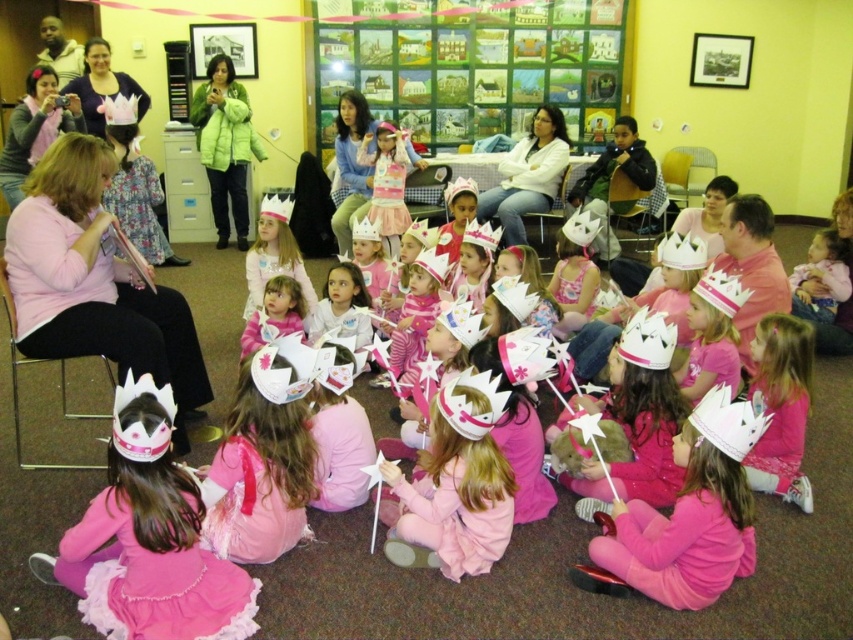
Can you confirm if pink satin dress at center is shorter than matte pink crown at upper left?

No.

Describe the element at coordinates (387, 182) in the screenshot. I see `pink satin dress at center` at that location.

Which is in front, point (393, 152) or point (97, 36)?

Positioned in front is point (393, 152).

Find the location of a particular element. pink satin dress at center is located at coordinates (387, 182).

Does green matte bulletin board at upper center lie in front of pink paper crown at center?

That is False.

This screenshot has height=640, width=853. Describe the element at coordinates (474, 65) in the screenshot. I see `green matte bulletin board at upper center` at that location.

The height and width of the screenshot is (640, 853). Identify the location of green matte bulletin board at upper center. (474, 65).

Between point (428, 516) and point (399, 192), which one is positioned behind?

The point (399, 192) is more distant.

Who is more forward, (450, 432) or (392, 129)?

Point (450, 432)

The image size is (853, 640). Identify the location of pink paper crown at center. (x=456, y=484).